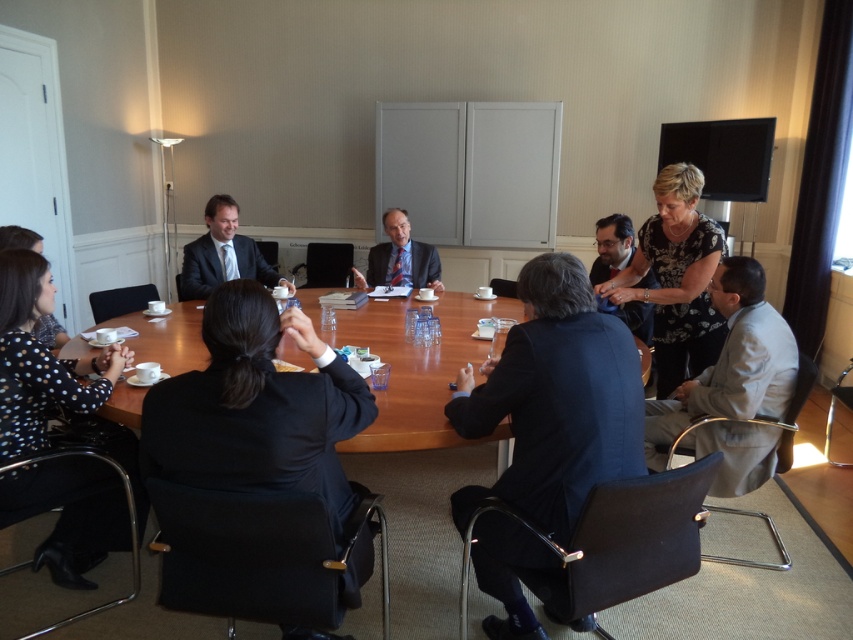
You are attending a meeting and need to choose a seat. You want to sit next to the taller suit between the light gray suit at lower right and the matte black suit at left. Which suit should you sit next to?

The light gray suit at lower right has a greater height compared to the matte black suit at left, so you should sit next to the light gray suit at lower right.

You are organizing a photo shoot and need to ensure that the two suits in the conference room are spaced appropriately. Given that the matte black suit at left and the matte blue suit at center are part of the setup, which suit requires more space between it and other objects due to its size?

The matte black suit at left requires more space between it and other objects because its width is larger than the matte blue suit at center.